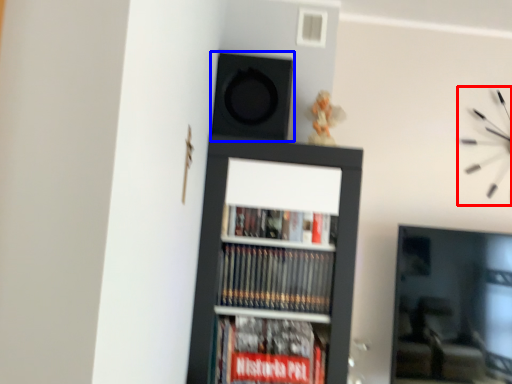
Question: Which of the following is the farthest to the observer, clock (highlighted by a red box) or speaker (highlighted by a blue box)?

Choices:
 (A) clock
 (B) speaker

Answer: (A)